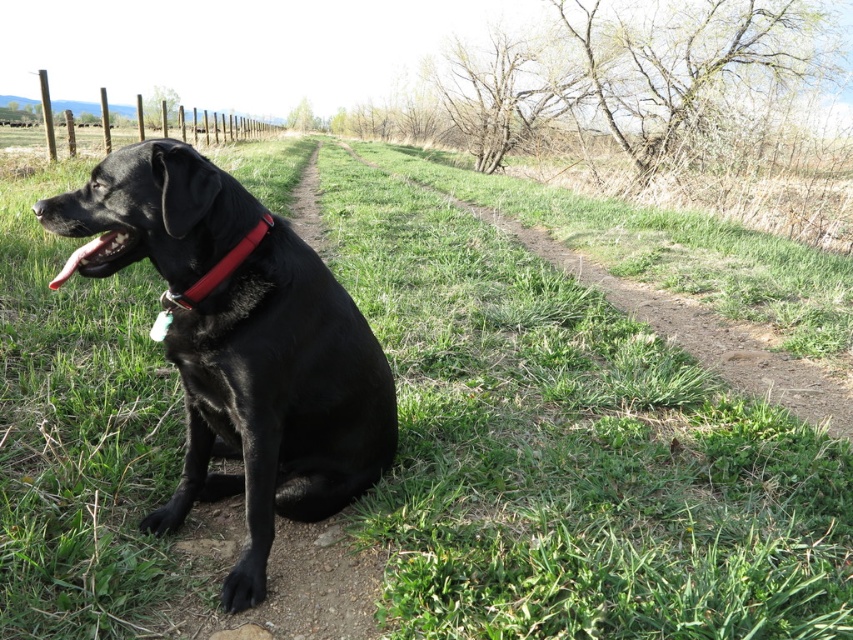
You are standing at the point with coordinates point (65, 260) and want to walk towards the point (230, 493). According to the scene, which direction should you face to move towards the desired point?

To move from point (65, 260) to point (230, 493), you should face towards the northeast direction since point (230, 493) is located northeast of point (65, 260).

You are standing at the camera position and want to throw a ball to the shiny black dog at center. The ball has a diameter of 0.1 meters. Will the ball reach the dog if you throw it directly towards the dog?

The shiny black dog at center is 1.79 meters away from the camera. Assuming you can throw the ball that distance, yes, the ball will reach the dog if thrown directly towards it.